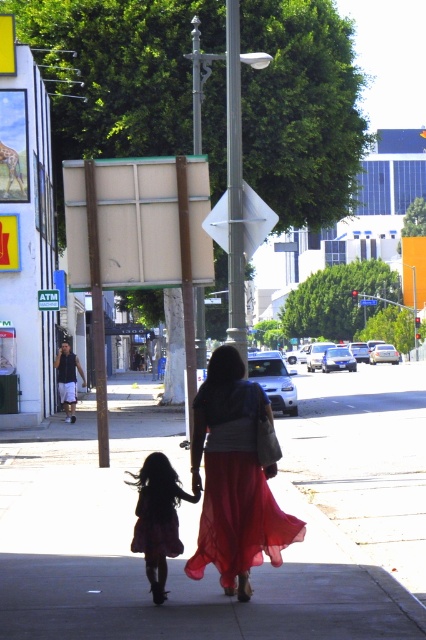
You are a photographer trying to capture the red chiffon dress at center in your shot. Based on the scene description, where should you position your camera relative to the dress to ensure it is centered in the frame?

The red chiffon dress at center is already positioned at the center of the frame, so you should aim your camera directly at that point to keep it centered.

From the picture: You are a delivery robot that needs to place a package on the smooth concrete sidewalk at center. However, there is a red chiffon dress at center in the way. Can you place the package there without moving the dress?

The smooth concrete sidewalk at center is not as tall as red chiffon dress at center, so the dress is taller than the sidewalk. Since the dress is on the sidewalk, you cannot place the package there without moving the dress.

You are a photographer trying to capture both the red chiffon dress at center and the silky purple dress at lower left in the same frame. Which dress should you focus on first to ensure both are in the shot?

The red chiffon dress at center is much taller than the silky purple dress at lower left, so you should focus on the red chiffon dress at center first to ensure both are in the shot.